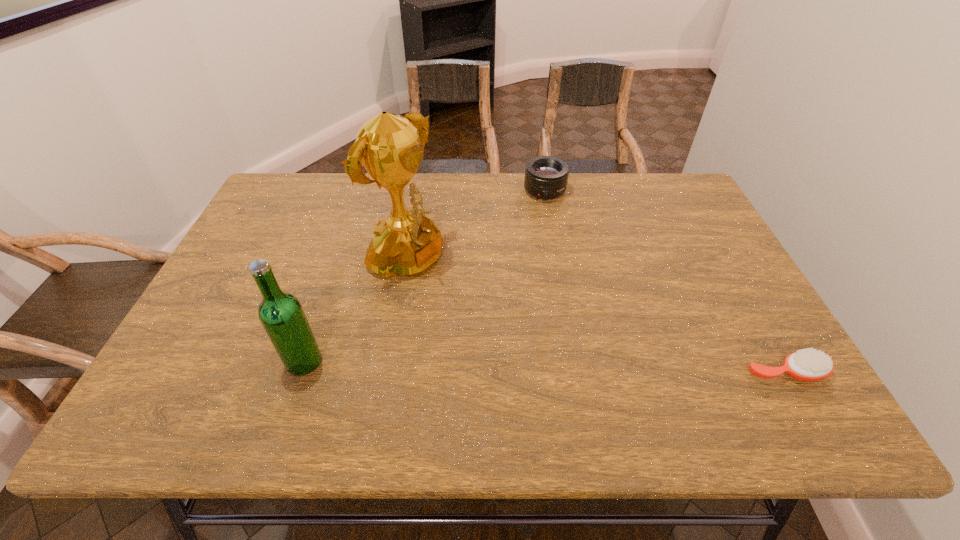
At what (x,y) coordinates should I click in order to perform the action: click on vacant region located 0.140m on the front side of the tallest object. Please return your answer as a coordinate pair (x, y). Image resolution: width=960 pixels, height=540 pixels. Looking at the image, I should click on (476, 307).

What are the coordinates of `vacant region located 0.150m on the front side of the tallest object` in the screenshot? It's located at (479, 308).

Find the location of `free location located on the front side of the tallest object`. free location located on the front side of the tallest object is located at coordinates (564, 358).

The image size is (960, 540). What are the coordinates of `vacant area located on the side of the telephoto lens with brand markings and control switches` in the screenshot? It's located at (552, 218).

Identify the location of vacant space situated 0.210m on the side of the telephoto lens with brand markings and control switches. (561, 248).

Identify the location of vacant point located 0.160m on the side of the telephoto lens with brand markings and control switches. The image size is (960, 540). (557, 237).

Find the location of a particular element. This screenshot has width=960, height=540. object that is at the far edge is located at coordinates (546, 177).

Locate an element on the screen. The image size is (960, 540). beer bottle at the near edge is located at coordinates (281, 314).

This screenshot has height=540, width=960. In order to click on hairbrush that is at the near edge in this screenshot , I will do `click(808, 364)`.

The width and height of the screenshot is (960, 540). In order to click on object present at the right edge in this screenshot , I will do `click(808, 364)`.